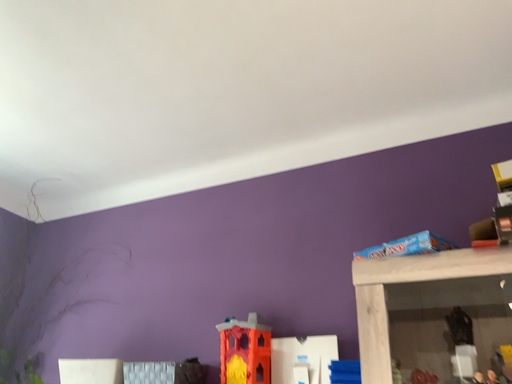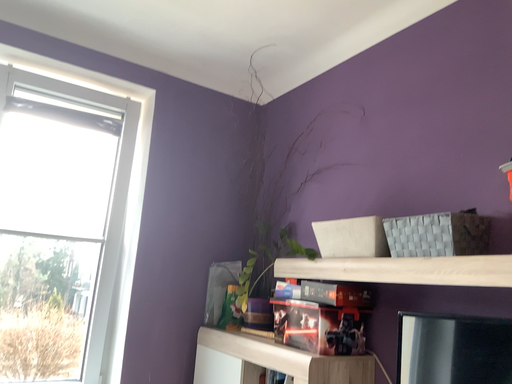
Question: Which way did the camera rotate in the video?

Choices:
 (A) rotated left
 (B) rotated right

Answer: (A)